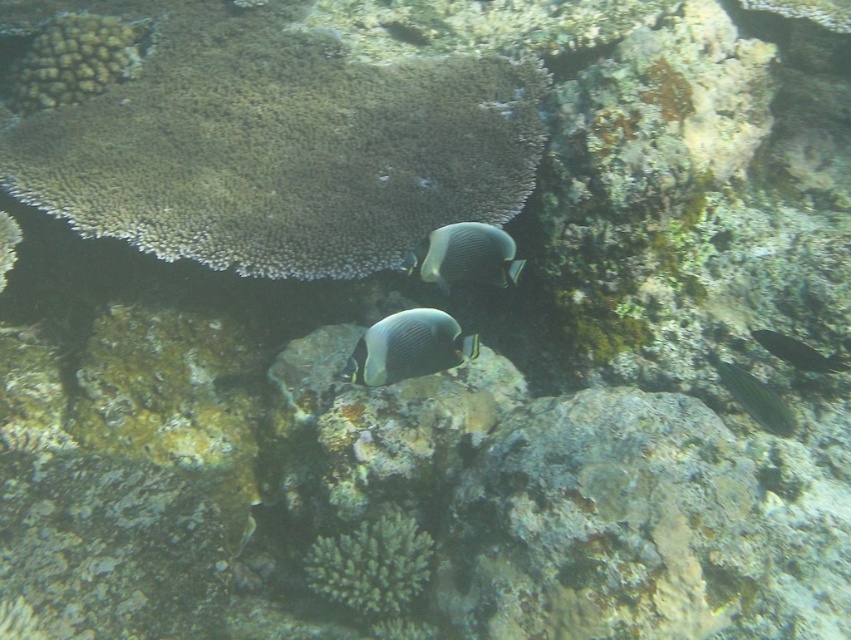
Looking at this image, who is positioned more to the right, brown textured coral at upper center or shiny green fish at lower right?

shiny green fish at lower right

Who is shorter, brown textured coral at upper center or shiny green fish at lower right?

shiny green fish at lower right is shorter.

The width and height of the screenshot is (851, 640). What do you see at coordinates (256, 134) in the screenshot?
I see `brown textured coral at upper center` at bounding box center [256, 134].

Locate an element on the screen. This screenshot has height=640, width=851. brown textured coral at upper center is located at coordinates (256, 134).

Does smooth gray fish at center have a smaller size compared to silvery metallic fish at lower right?

Actually, smooth gray fish at center might be larger than silvery metallic fish at lower right.

Is point (455, 225) positioned in front of point (834, 362)?

Yes, point (455, 225) is in front of point (834, 362).

Is point (424, 253) farther from viewer compared to point (789, 342)?

No, (424, 253) is closer to viewer.

This screenshot has height=640, width=851. Identify the location of smooth gray fish at center. (469, 256).

Between green matte coral at center and silvery metallic fish at lower right, which one has more height?

With more height is green matte coral at center.

Is green matte coral at center above silvery metallic fish at lower right?

Actually, green matte coral at center is below silvery metallic fish at lower right.

Who is more forward, (363, 534) or (801, 362)?

Positioned in front is point (363, 534).

Where is `green matte coral at center`? The height and width of the screenshot is (640, 851). green matte coral at center is located at coordinates (370, 564).